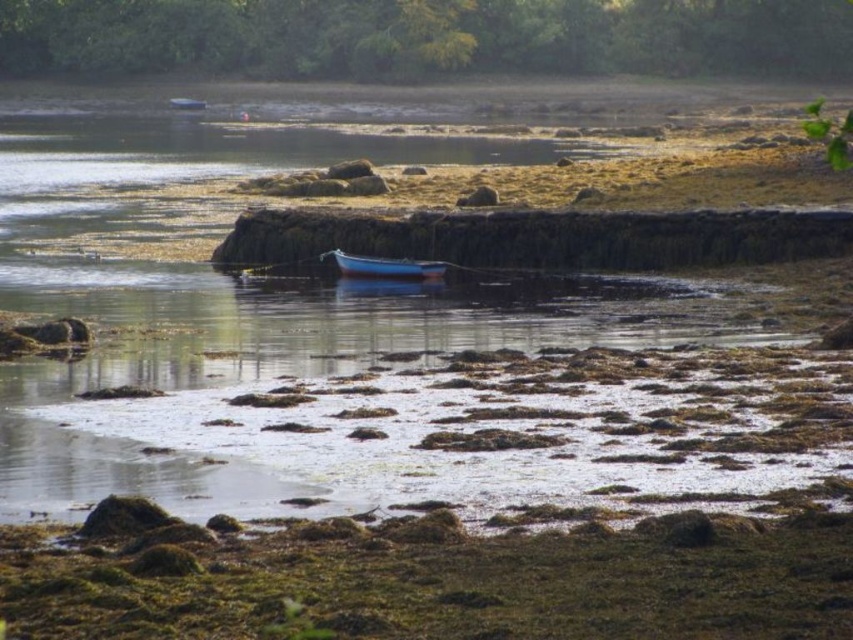
You are standing at the point with coordinates point [384,266]. What object are you standing on?

You are standing on the blue polished wood boat at center represented by point [384,266].

You are a marine biologist studying the coastal area. You need to place a buoy 1 meter away from the blue polished wood boat at center. Given the boat is at coordinates point 0.417, 0.451, where should the buoy be placed? Please provide the coordinates in the same format as the boat.

The buoy should be placed at coordinates point (x=384, y=266) plus or minus 1 meter in any direction, but since the exact direction isn

You are standing on the shore and see both the blue polished wood boat at center and the blue glossy boat at upper center. Which boat would appear larger to you?

The blue polished wood boat at center appears larger because it is closer to the viewer than the blue glossy boat at upper center.